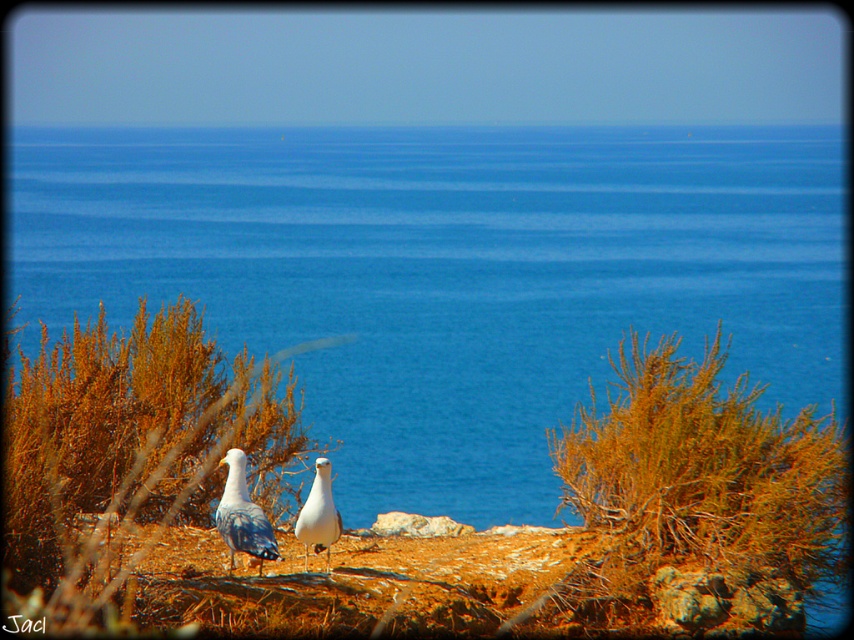
Question: Does brown textured bush at center right appear on the left side of white feathered bird at center?

Choices:
 (A) no
 (B) yes

Answer: (A)

Question: Does brown shrubbery at center have a greater width compared to white feathered bird at center?

Choices:
 (A) yes
 (B) no

Answer: (A)

Question: Is brown shrubbery at center bigger than brown textured bush at center right?

Choices:
 (A) no
 (B) yes

Answer: (B)

Question: Based on their relative distances, which object is farther from the brown shrubbery at center?

Choices:
 (A) white feathered seagull at lower center
 (B) brown textured bush at center right
 (C) blue water at center
 (D) white feathered bird at center

Answer: (C)

Question: Which object is positioned closest to the white feathered bird at center?

Choices:
 (A) brown shrubbery at center
 (B) brown textured bush at center right
 (C) blue water at center

Answer: (A)

Question: Which point is closer to the camera?

Choices:
 (A) (256, 365)
 (B) (709, 243)

Answer: (A)